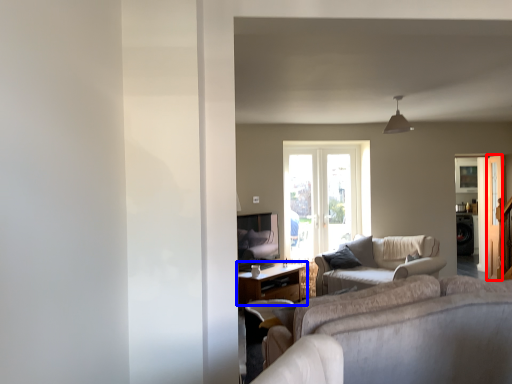
Question: Among these objects, which one is farthest to the camera, screen door (highlighted by a red box) or table (highlighted by a blue box)?

Choices:
 (A) screen door
 (B) table

Answer: (A)